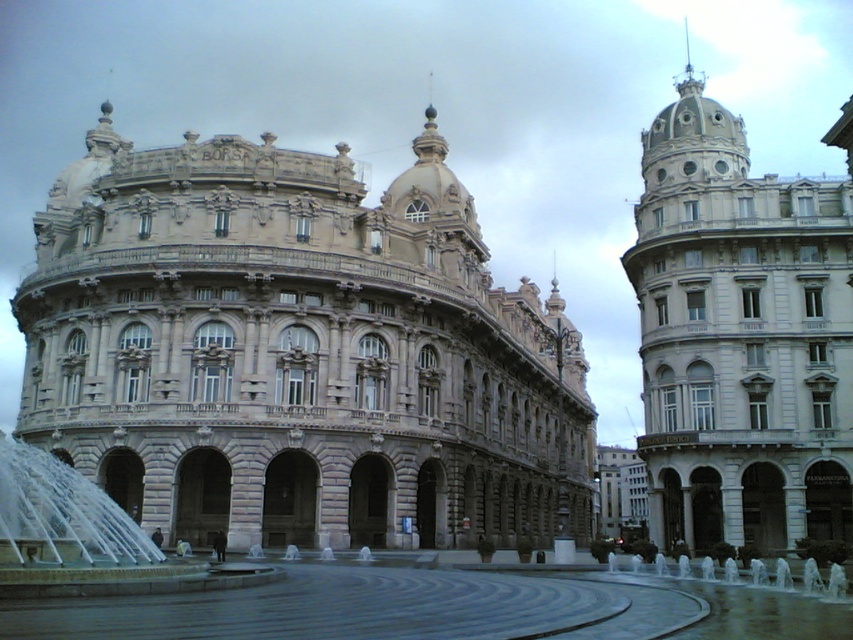
You are a tourist standing at the edge of the plaza. You want to take a photo of the beige stone building at center without the clear glass water at center appearing in the shot. Is this possible given their positions?

The clear glass water at center is behind the beige stone building at center, so if you position yourself in front of the building, the water will be hidden behind it, making it possible to take a photo of the beige stone building at center without the clear glass water at center in the frame.

You are standing in the plaza in front of the beige stone building at center and clear glass water at center. Which object is positioned further to the right?

The clear glass water at center is positioned further to the right than the beige stone building at center.

You are standing at the center of the plaza and want to take a photo of the beige stone building at center. In which direction should you point your camera to capture the building?

Since the beige stone building at center is positioned at point 0.550 on the x coordinate and 0.349 on the y coordinate, you should point your camera towards the north direction to capture the building.